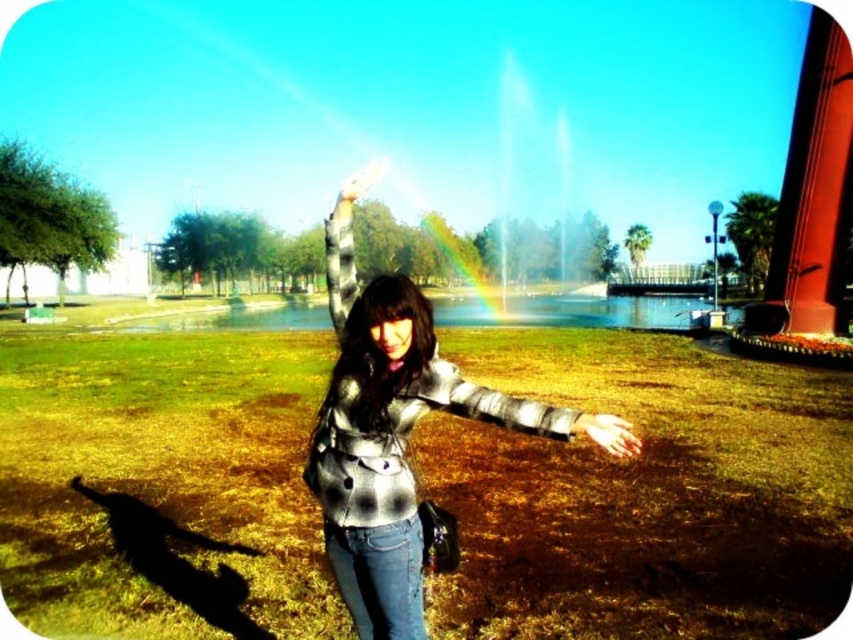
Is denim jeans at center above smooth skin hand at lower center?

No, denim jeans at center is not above smooth skin hand at lower center.

Does denim jeans at center have a lesser width compared to smooth skin hand at lower center?

No.

This screenshot has width=853, height=640. Find the location of `denim jeans at center`. denim jeans at center is located at coordinates (379, 577).

In the scene shown: Does plaid fabric shirt at center appear on the right side of plaid fabric arm at center?

In fact, plaid fabric shirt at center is to the left of plaid fabric arm at center.

Can you confirm if plaid fabric shirt at center is positioned below plaid fabric arm at center?

No.

Is point (376, 577) in front of point (612, 438)?

No, (376, 577) is further to viewer.

Locate an element on the screen. Image resolution: width=853 pixels, height=640 pixels. plaid fabric shirt at center is located at coordinates (387, 435).

Between point (579, 429) and point (340, 188), which one is positioned in front?

Point (579, 429)

Is smooth skin hand at lower center positioned behind matte black hand at center?

No.

Between point (633, 442) and point (351, 198), which one is positioned in front?

Point (633, 442) is in front.

The height and width of the screenshot is (640, 853). What are the coordinates of `smooth skin hand at lower center` in the screenshot? It's located at (608, 433).